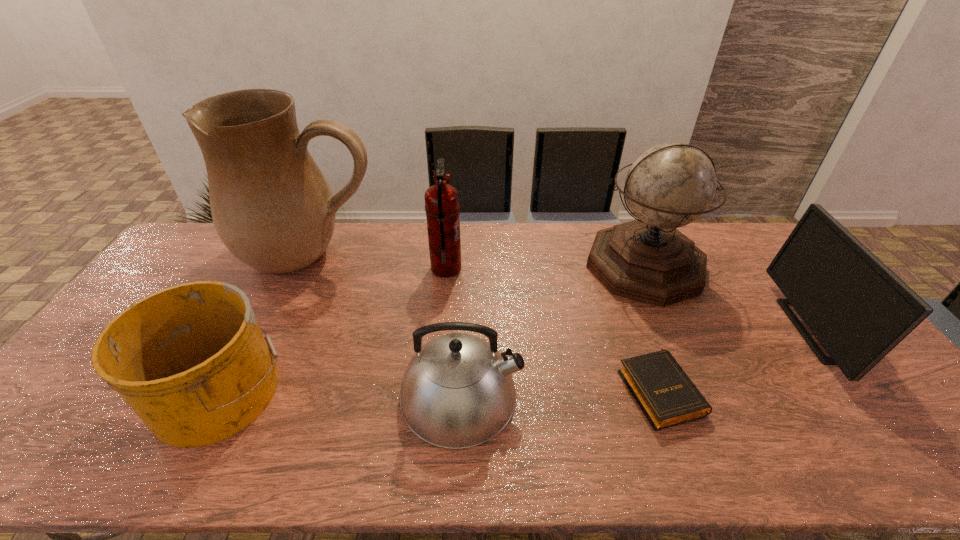
Identify the location of cream pitcher. (273, 209).

Image resolution: width=960 pixels, height=540 pixels. What are the coordinates of `the sixth shortest object` in the screenshot? It's located at (670, 185).

The width and height of the screenshot is (960, 540). In order to click on the fifth shortest object in this screenshot , I will do `click(442, 206)`.

Where is `computer monitor`? Image resolution: width=960 pixels, height=540 pixels. computer monitor is located at coordinates (859, 310).

Where is `kettle`? The image size is (960, 540). kettle is located at coordinates (458, 391).

The width and height of the screenshot is (960, 540). In order to click on bucket in this screenshot , I will do `click(191, 361)`.

Identify the location of the shortest object. This screenshot has width=960, height=540. (665, 394).

Image resolution: width=960 pixels, height=540 pixels. Find the location of `vacant space situated 0.300m at the spout of the tallest object`. vacant space situated 0.300m at the spout of the tallest object is located at coordinates (259, 368).

The image size is (960, 540). In order to click on free space located on the surface of the globe in this screenshot , I will do `click(687, 363)`.

Find the location of a particular element. This screenshot has height=540, width=960. free space located 0.370m on the side of the fire extinguisher with the handle and hose is located at coordinates (573, 268).